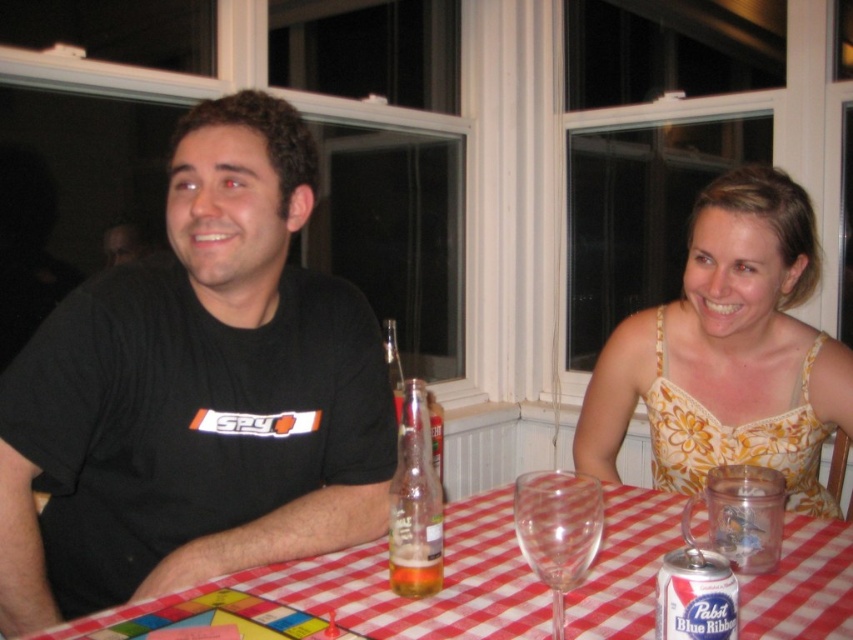
Question: From the image, what is the correct spatial relationship of yellow floral dress at center in relation to translucent glass beer at table center?

Choices:
 (A) right
 (B) left

Answer: (A)

Question: Is the position of red checkered tablecloth at lower center less distant than that of pabst blue ribbon can at table?

Choices:
 (A) no
 (B) yes

Answer: (A)

Question: Can you confirm if yellow floral dress at center is positioned to the right of red checkered tablecloth at lower center?

Choices:
 (A) no
 (B) yes

Answer: (B)

Question: Which object is positioned farthest from the red checkered tablecloth at lower center?

Choices:
 (A) translucent glass bottle at table center
 (B) transparent glass at table center

Answer: (A)

Question: Which point is closer to the camera taking this photo?

Choices:
 (A) (663, 392)
 (B) (428, 579)

Answer: (B)

Question: Which object is closer to the camera taking this photo?

Choices:
 (A) red checkered tablecloth at lower center
 (B) pabst blue ribbon can at table
 (C) translucent glass beer at table center

Answer: (B)